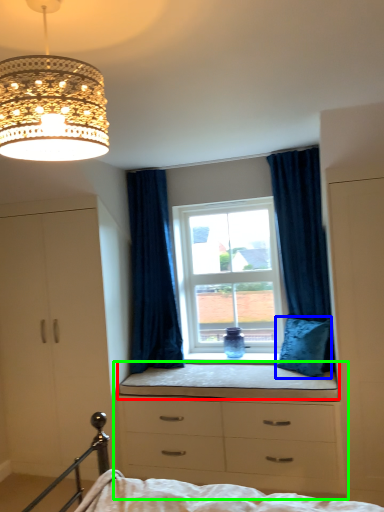
Question: Considering the real-world distances, which object is closest to window sill (highlighted by a red box)? pillow (highlighted by a blue box) or chest of drawers (highlighted by a green box).

Choices:
 (A) pillow
 (B) chest of drawers

Answer: (B)